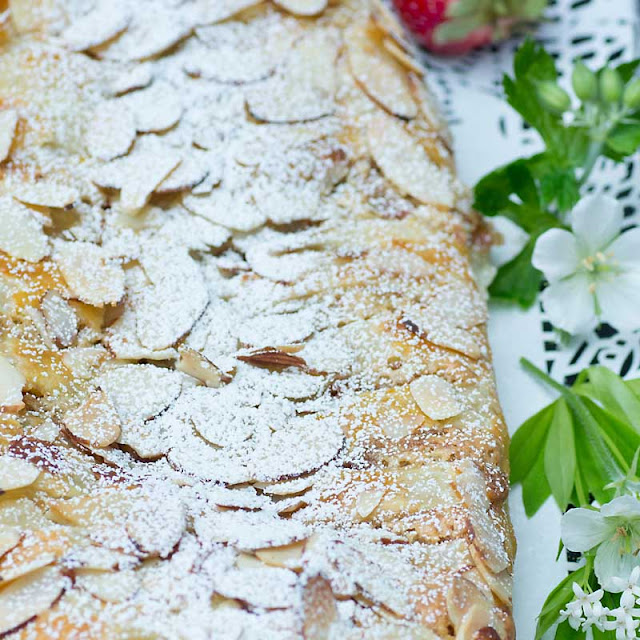
What are the coordinates of `doily` in the screenshot? It's located at (515, 326), (603, 25), (483, 131), (537, 573).